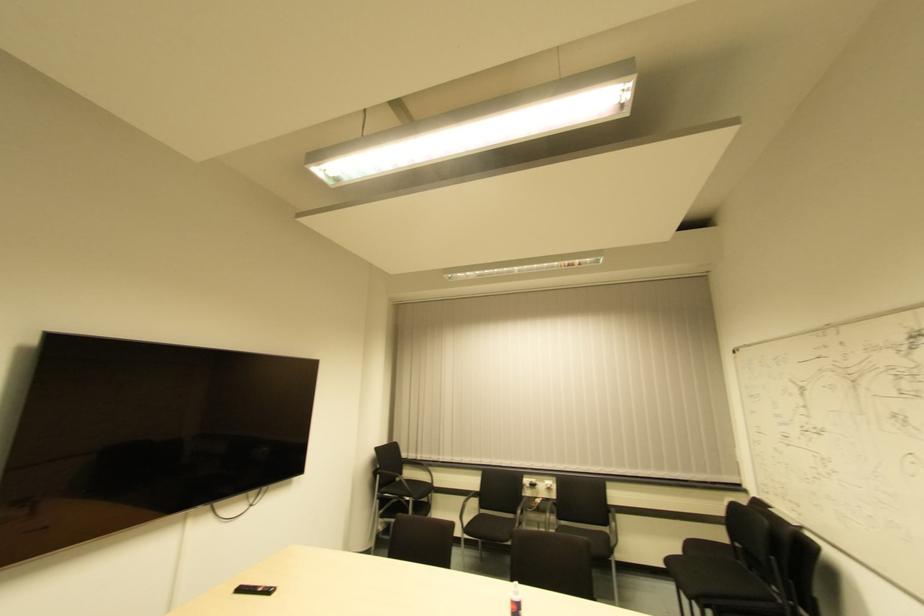
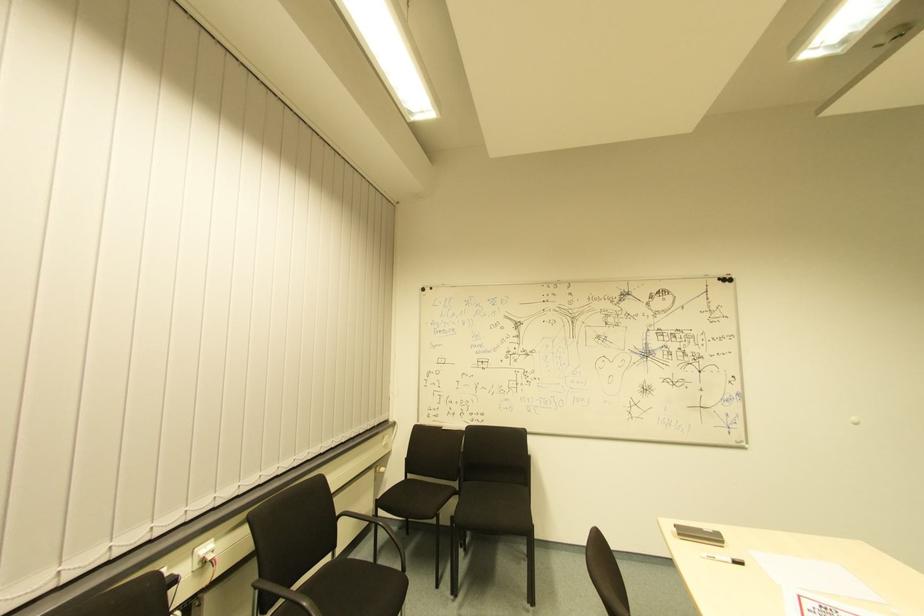
Where in the second image is the point corresponding to point (546, 488) from the first image?

(208, 561)